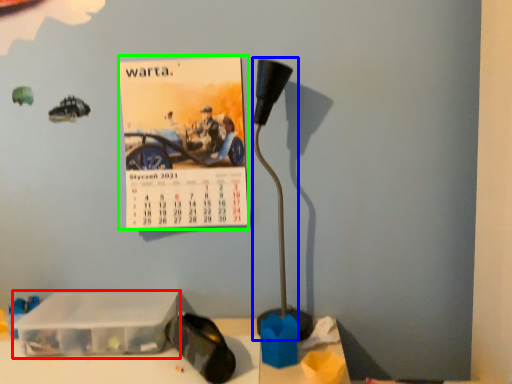
Question: Estimate the real-world distances between objects in this image. Which object is closer to box (highlighted by a red box), lamp (highlighted by a blue box) or postcard (highlighted by a green box)?

Choices:
 (A) lamp
 (B) postcard

Answer: (B)